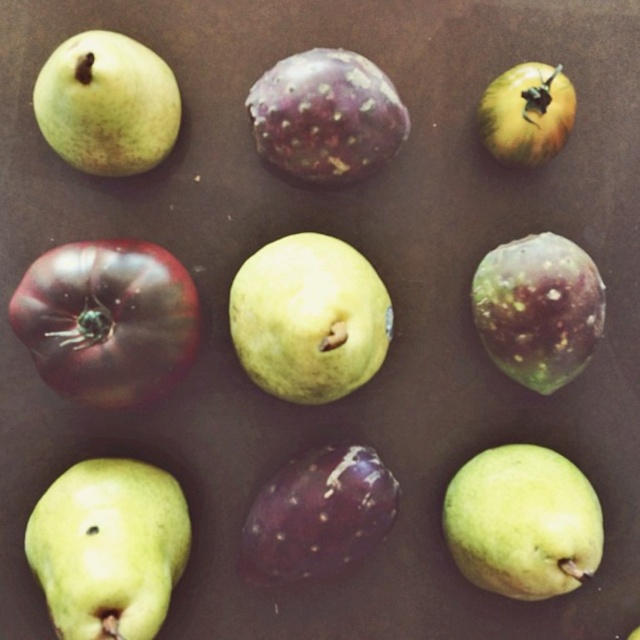
You are standing at the origin point of the coordinate system. You see two points labeled as point (108, 113) and point (528, 369). Which point is closer to you?

Point (108, 113) is closer to you because it is in front of point (528, 369).

In the scene shown: You are arranging fruits on a shelf and need to stack them vertically. Given the green matte pear at lower right and the green matte pear at upper left, which one should you choose to place at the bottom to ensure stability?

The green matte pear at lower right is much taller than the green matte pear at upper left, so placing the taller pear at the bottom would provide better stability due to its height and base area.